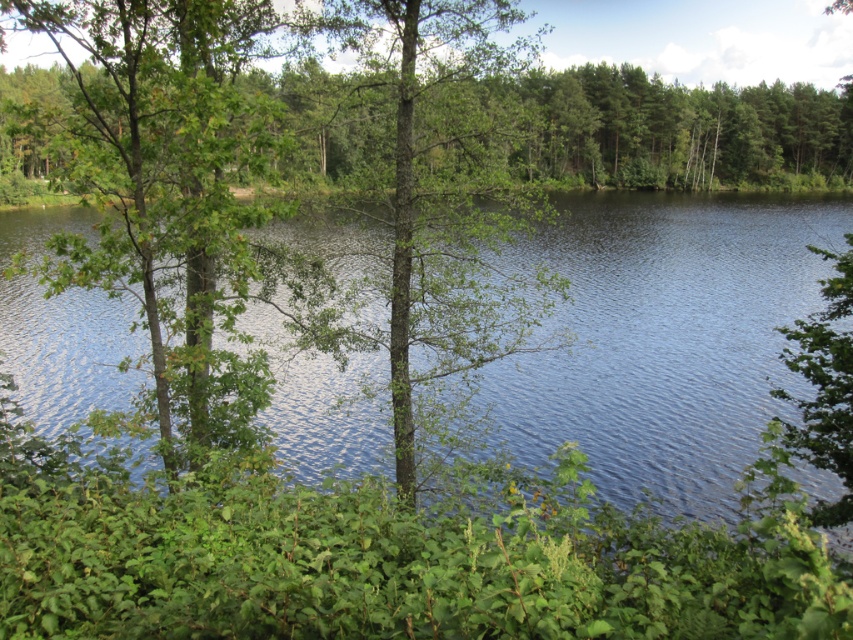
Does blue water at center have a smaller size compared to green rough bark tree at center?

No, blue water at center is not smaller than green rough bark tree at center.

Can you confirm if blue water at center is bigger than green rough bark tree at center?

Yes.

Is point (695, 451) more distant than point (399, 275)?

That is True.

Where is `blue water at center`? This screenshot has height=640, width=853. blue water at center is located at coordinates (662, 339).

Is blue water at center wider than green leafy tree at left?

Correct, the width of blue water at center exceeds that of green leafy tree at left.

Does blue water at center appear under green leafy tree at left?

Yes.

Does point (670, 333) come closer to viewer compared to point (225, 248)?

No, it is behind (225, 248).

Locate an element on the screen. Image resolution: width=853 pixels, height=640 pixels. blue water at center is located at coordinates (662, 339).

Does green leafy tree at left appear on the left side of green rough bark tree at center?

Correct, you'll find green leafy tree at left to the left of green rough bark tree at center.

Image resolution: width=853 pixels, height=640 pixels. Find the location of `green leafy tree at left`. green leafy tree at left is located at coordinates (161, 179).